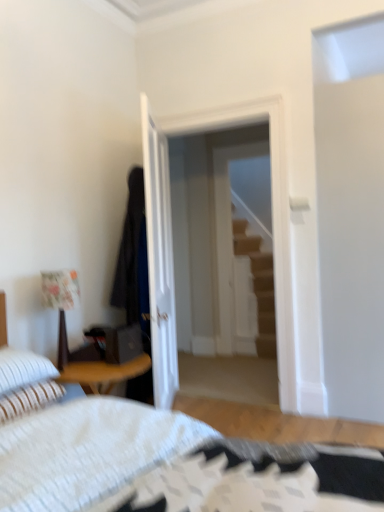
Question: Considering the relative positions of floral fabric lampshade at left and white textured bed at lower left in the image provided, is floral fabric lampshade at left to the left or to the right of white textured bed at lower left?

Choices:
 (A) right
 (B) left

Answer: (B)

Question: Relative to white textured bed at lower left, is floral fabric lampshade at left in front or behind?

Choices:
 (A) front
 (B) behind

Answer: (B)

Question: Which object is positioned farthest from the dark blue fabric robe at center?

Choices:
 (A) white striped pillow at lower left, which is the 2th pillow from top to bottom
 (B) wooden staircase at center
 (C) white striped pillow at lower left, the first pillow viewed from the top
 (D) transparent glass door at center
 (E) floral fabric lampshade at left

Answer: (B)

Question: Which of these objects is positioned closest to the white striped pillow at lower left, the first pillow viewed from the top?

Choices:
 (A) white glossy door at center
 (B) wooden staircase at center
 (C) transparent glass door at center
 (D) floral fabric lampshade at left
 (E) dark blue fabric robe at center

Answer: (D)